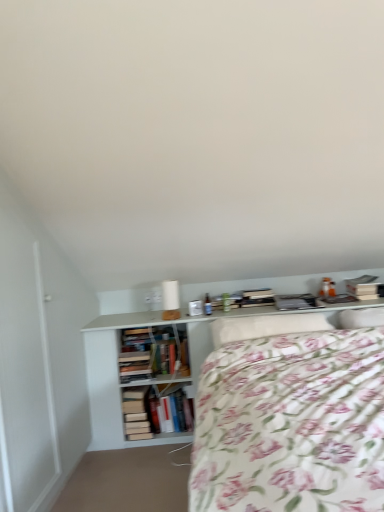
Question: Is white soft pillow at upper right wider or thinner than white matte shelf at center?

Choices:
 (A) wide
 (B) thin

Answer: (B)

Question: From a real-world perspective, is white soft pillow at upper right physically located above or below white matte shelf at center?

Choices:
 (A) above
 (B) below

Answer: (A)

Question: Which object is the closest to the white soft pillow at upper right?

Choices:
 (A) hardcover books at center
 (B) floral fabric bed at center
 (C) white matte shelf at center

Answer: (B)

Question: Estimate the real-world distances between objects in this image. Which object is closer to the hardcover books at center?

Choices:
 (A) white matte shelf at center
 (B) floral fabric bed at center
 (C) white soft pillow at upper right

Answer: (A)